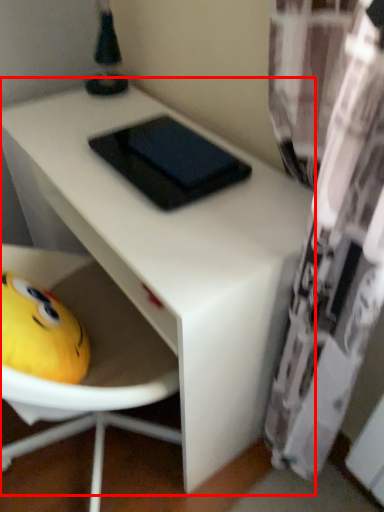
Question: From the image's perspective, what is the correct spatial positioning of table (annotated by the red box) in reference to pad?

Choices:
 (A) above
 (B) below

Answer: (B)